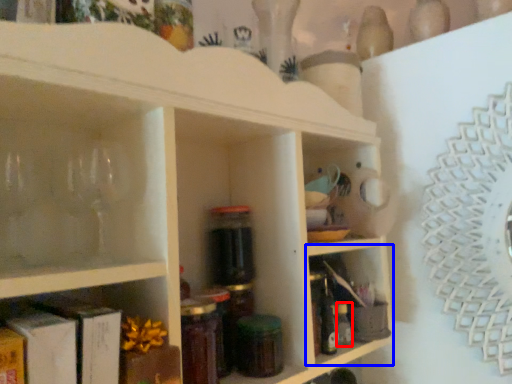
Question: Which object is closer to the camera taking this photo, bottle (highlighted by a red box) or shelf (highlighted by a blue box)?

Choices:
 (A) bottle
 (B) shelf

Answer: (B)